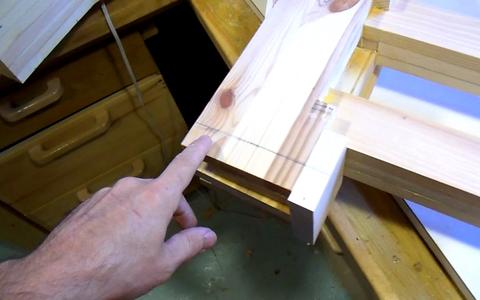
Locate an element on the screen. cord is located at coordinates (125, 50).